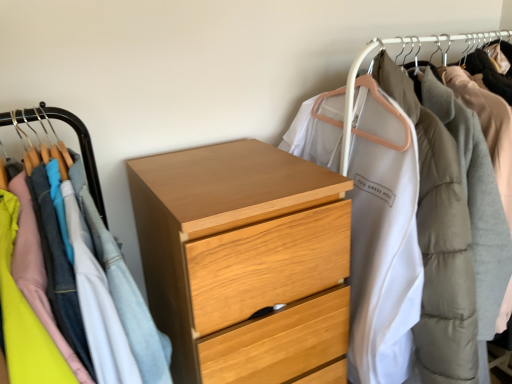
Question: Is wooden chest of drawers at center, which is the first closet from left to right, looking in the opposite direction of white matte coat at upper right, the 2th closet viewed from the left?

Choices:
 (A) no
 (B) yes

Answer: (A)

Question: Does wooden chest of drawers at center, which ranks as the second closet in right-to-left order, come in front of white matte coat at upper right, which is the 1th closet in right-to-left order?

Choices:
 (A) yes
 (B) no

Answer: (A)

Question: Considering the relative sizes of wooden chest of drawers at center, which is the first closet from left to right, and white matte coat at upper right, which is the 1th closet in right-to-left order, in the image provided, is wooden chest of drawers at center, which is the first closet from left to right, thinner than white matte coat at upper right, which is the 1th closet in right-to-left order,?

Choices:
 (A) yes
 (B) no

Answer: (A)

Question: Considering the relative sizes of wooden chest of drawers at center, which is the first closet from left to right, and white matte coat at upper right, the 2th closet viewed from the left, in the image provided, is wooden chest of drawers at center, which is the first closet from left to right, taller than white matte coat at upper right, the 2th closet viewed from the left,?

Choices:
 (A) yes
 (B) no

Answer: (B)

Question: From a real-world perspective, is wooden chest of drawers at center, which ranks as the second closet in right-to-left order, on white matte coat at upper right, which is the 1th closet in right-to-left order?

Choices:
 (A) no
 (B) yes

Answer: (A)

Question: In terms of height, does wooden chest of drawers at center, which is the first closet from left to right, look taller or shorter compared to white matte coat at upper right, the 2th closet viewed from the left?

Choices:
 (A) tall
 (B) short

Answer: (B)

Question: Would you say wooden chest of drawers at center, which is the first closet from left to right, is to the left or to the right of white matte coat at upper right, which is the 1th closet in right-to-left order, in the picture?

Choices:
 (A) left
 (B) right

Answer: (A)

Question: From a real-world perspective, relative to white matte coat at upper right, the 2th closet viewed from the left, is wooden chest of drawers at center, which is the first closet from left to right, vertically above or below?

Choices:
 (A) below
 (B) above

Answer: (A)

Question: Is point (72, 114) positioned closer to the camera than point (460, 326)?

Choices:
 (A) farther
 (B) closer

Answer: (A)

Question: From the image's perspective, relative to wooden chest of drawers at center, which ranks as the second closet in right-to-left order, is white matte coat at upper right, the 2th closet viewed from the left, above or below?

Choices:
 (A) above
 (B) below

Answer: (A)

Question: From a real-world perspective, is white matte coat at upper right, which is the 1th closet in right-to-left order, positioned above or below wooden chest of drawers at center, which ranks as the second closet in right-to-left order?

Choices:
 (A) above
 (B) below

Answer: (A)

Question: Looking at the image, does white matte coat at upper right, the 2th closet viewed from the left, seem bigger or smaller compared to wooden chest of drawers at center, which is the first closet from left to right?

Choices:
 (A) small
 (B) big

Answer: (B)

Question: Is white matte coat at upper right, the 2th closet viewed from the left, wider or thinner than wooden chest of drawers at center, which is the first closet from left to right?

Choices:
 (A) wide
 (B) thin

Answer: (A)

Question: From the image's perspective, relative to wooden chest of drawers at center, which ranks as the second closet in right-to-left order, is light wood chest of drawers at center above or below?

Choices:
 (A) above
 (B) below

Answer: (B)

Question: Considering the positions of light wood chest of drawers at center and wooden chest of drawers at center, which is the first closet from left to right, in the image, is light wood chest of drawers at center bigger or smaller than wooden chest of drawers at center, which is the first closet from left to right,?

Choices:
 (A) small
 (B) big

Answer: (B)